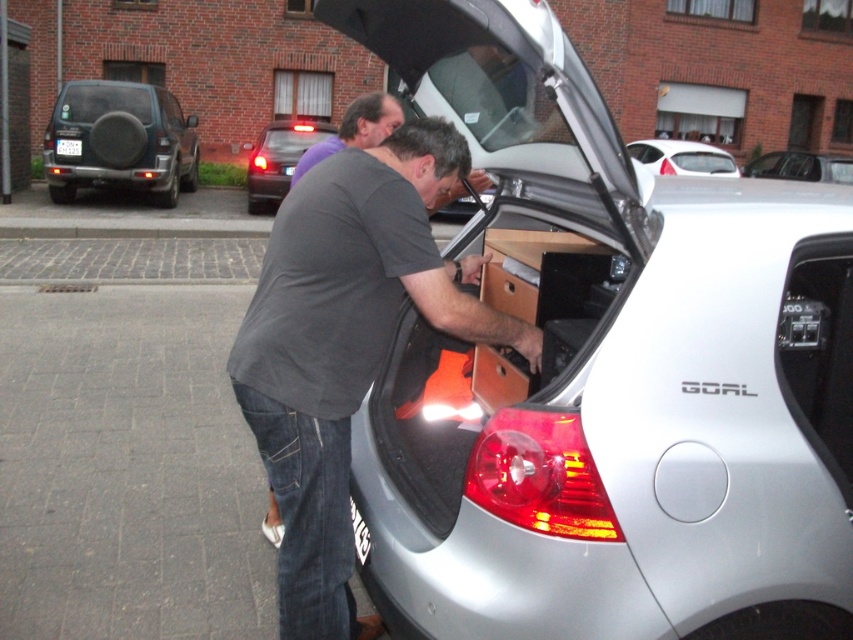
You are a delivery person who needs to park your vehicle in the same spot as the silver metallic car at center. What coordinates should you use to park your vehicle?

The silver metallic car at center is positioned at coordinates point (605, 374), so you should park your vehicle at those coordinates to match its position.

You are standing at the point marked as point (x=119, y=141). What object are you facing?

The point (x=119, y=141) corresponds to the matte black suv at left, so you are facing the matte black suv at left.